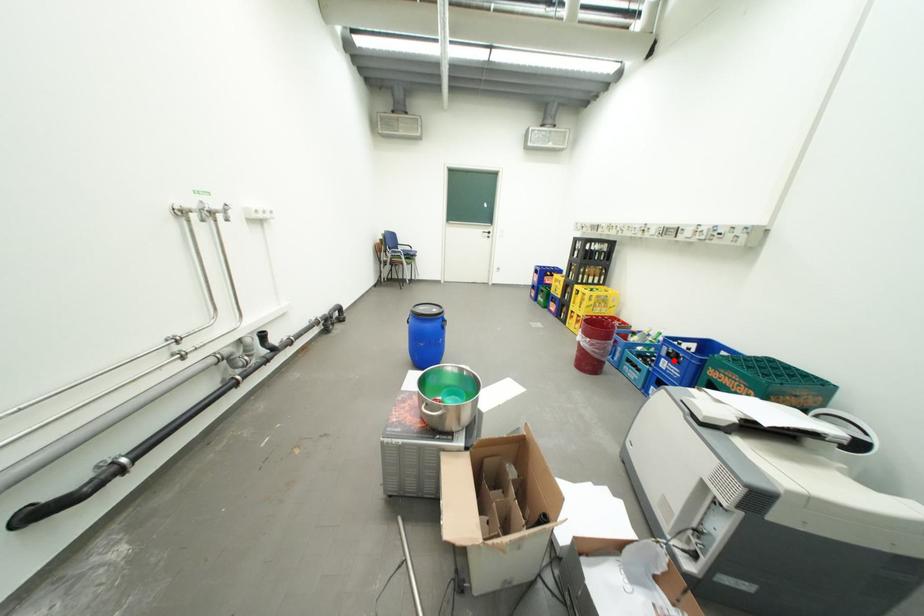
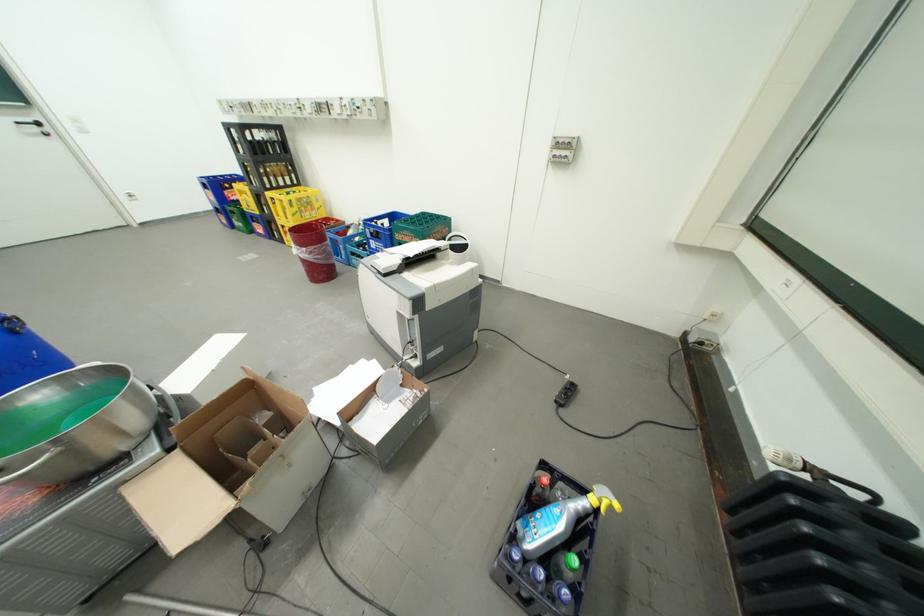
Question: I am providing you with two images of the same scene from different viewpoints. A red point is shown in image1. For the corresponding object point in image2, is it positioned nearer or farther from the camera?

Choices:
 (A) Nearer
 (B) Farther

Answer: (B)